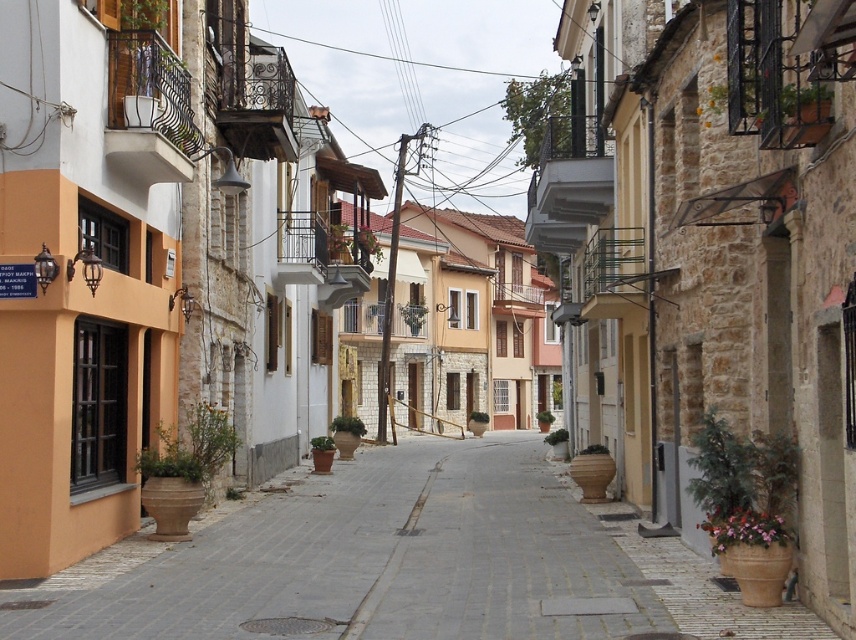
Is terracotta clay pots at center smaller than smooth concrete sidewalk at center?

Indeed, terracotta clay pots at center has a smaller size compared to smooth concrete sidewalk at center.

How distant is terracotta clay pots at center from smooth concrete sidewalk at center?

terracotta clay pots at center and smooth concrete sidewalk at center are 24.68 inches apart from each other.

Is point (528, 541) closer to viewer compared to point (388, 497)?

Yes, point (528, 541) is closer to viewer.

Where is `terracotta clay pots at center`? This screenshot has height=640, width=856. terracotta clay pots at center is located at coordinates (373, 561).